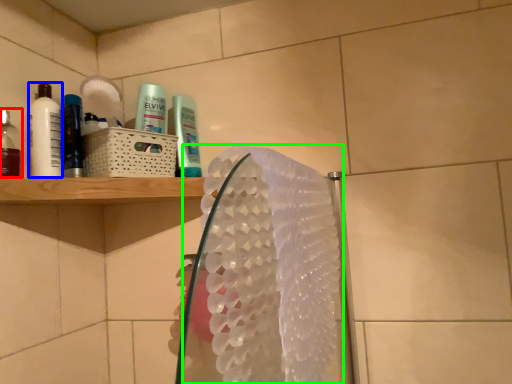
Question: Which object is positioned closest to mouthwash (highlighted by a red box)? Select from mouthwash (highlighted by a blue box) and hand towel (highlighted by a green box).

Choices:
 (A) mouthwash
 (B) hand towel

Answer: (A)